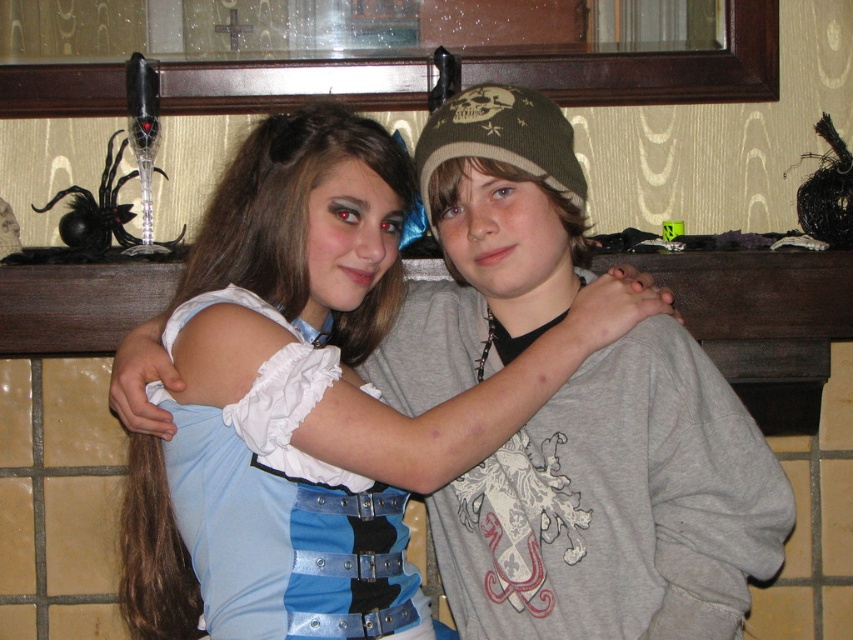
Between gray cotton sweatshirt at center and blue satin dress at center, which one appears on the right side from the viewer's perspective?

From the viewer's perspective, gray cotton sweatshirt at center appears more on the right side.

Which is below, gray cotton sweatshirt at center or blue satin dress at center?

blue satin dress at center is lower down.

Between point (486, 592) and point (354, 131), which one is positioned behind?

The point (486, 592) is more distant.

Where is `gray cotton sweatshirt at center`? Image resolution: width=853 pixels, height=640 pixels. gray cotton sweatshirt at center is located at coordinates (618, 506).

Which is below, blue satin dress at center or light blue fabric dress at center?

light blue fabric dress at center

From the picture: Is blue satin dress at center wider than light blue fabric dress at center?

Indeed, blue satin dress at center has a greater width compared to light blue fabric dress at center.

Does point (596, 301) come farther from viewer compared to point (161, 397)?

Yes, it is behind point (161, 397).

Identify the location of blue satin dress at center. This screenshot has height=640, width=853. (350, 301).

Can you confirm if gray cotton sweatshirt at center is positioned to the right of light blue fabric dress at center?

Correct, you'll find gray cotton sweatshirt at center to the right of light blue fabric dress at center.

Can you confirm if gray cotton sweatshirt at center is thinner than light blue fabric dress at center?

No, gray cotton sweatshirt at center is not thinner than light blue fabric dress at center.

Does point (531, 550) lie behind point (329, 529)?

Yes, point (531, 550) is behind point (329, 529).

Locate an element on the screen. gray cotton sweatshirt at center is located at coordinates (618, 506).